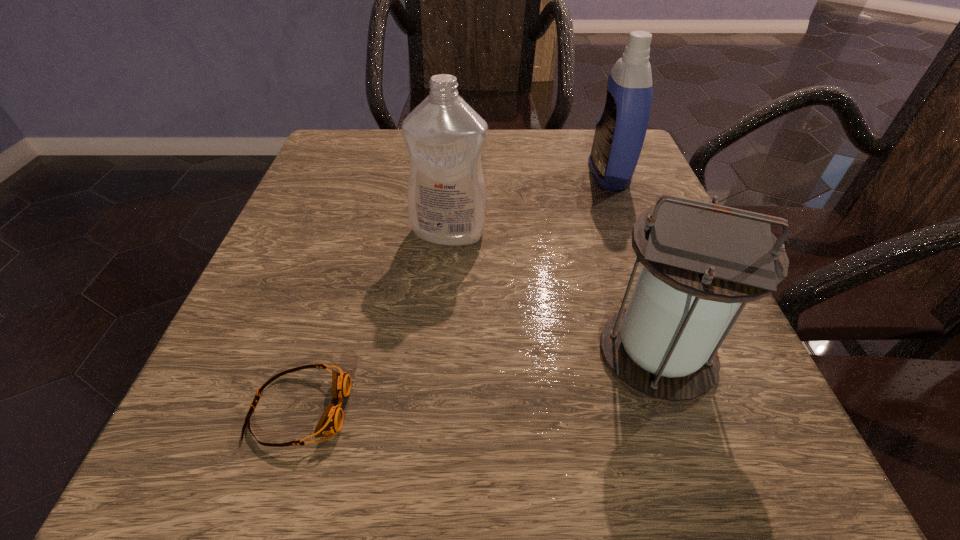
This screenshot has width=960, height=540. In the image, there is a desktop. Find the location of `vacant space at the left edge`. vacant space at the left edge is located at coordinates (358, 286).

This screenshot has height=540, width=960. Find the location of `blank area at the right edge`. blank area at the right edge is located at coordinates (728, 345).

This screenshot has width=960, height=540. I want to click on vacant space at the far left corner of the desktop, so click(329, 133).

The height and width of the screenshot is (540, 960). I want to click on free space at the far right corner of the desktop, so click(x=592, y=132).

This screenshot has width=960, height=540. In order to click on vacant area at the near right corner in this screenshot , I will do `click(724, 488)`.

I want to click on unoccupied position between the shortest object and the lantern, so click(x=478, y=381).

Find the location of `vacant space that is in between the farthest object and the goggles`. vacant space that is in between the farthest object and the goggles is located at coordinates (454, 292).

What are the coordinates of `blank region between the nearer detergent and the leftmost object` in the screenshot? It's located at (374, 321).

Identify the location of unoccupied position between the lantern and the nearer detergent. Image resolution: width=960 pixels, height=540 pixels. (553, 293).

At what (x,y) coordinates should I click in order to perform the action: click on free point between the lantern and the leftmost object. Please return your answer as a coordinate pair (x, y). Looking at the image, I should click on coord(478,381).